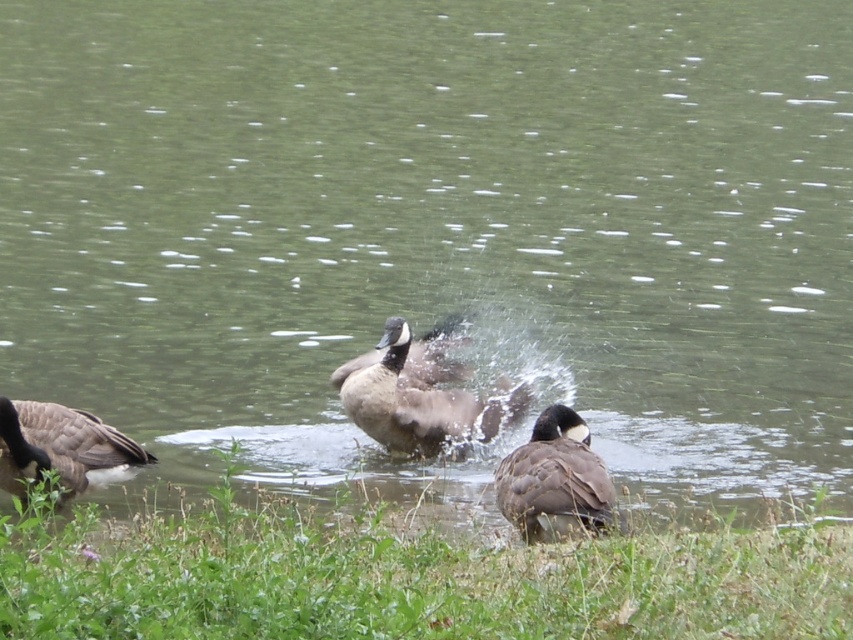
You are standing at the edge of the water and want to observe the brown feathered duck at lower left. According to the coordinates provided, where exactly is the duck positioned relative to your viewpoint?

The brown feathered duck at lower left is located at coordinates point (62, 449), which means it is positioned 70.2 percent from the left edge and 7.4 percent from the bottom edge of the image, placing it near the lower left corner of the scene.

You are standing at the edge of the water in the scene. There is a point marked at coordinates point (405, 577). What object is located at that point?

The point (405, 577) corresponds to green leafy grass at lower center.